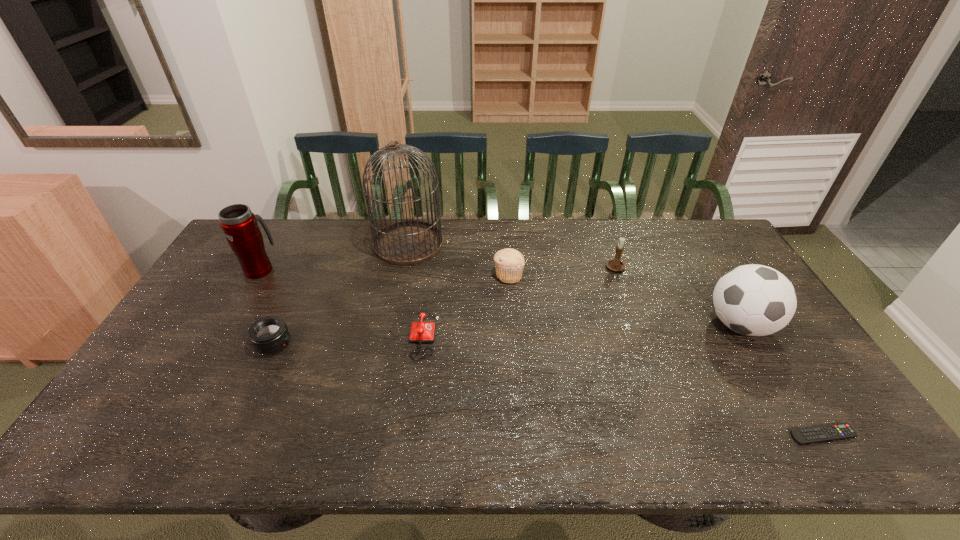
Locate an element on the screen. Image resolution: width=960 pixels, height=540 pixels. the shortest object is located at coordinates (808, 435).

This screenshot has height=540, width=960. Find the location of `vacant area situated 0.340m on the left of the tallest object`. vacant area situated 0.340m on the left of the tallest object is located at coordinates (279, 244).

What are the coordinates of `vacant space located on the side with the handle of the leftmost object` in the screenshot? It's located at (273, 248).

Find the location of a particular element. free space located 0.170m on the side with the handle of the leftmost object is located at coordinates (283, 231).

This screenshot has width=960, height=540. I want to click on free space located on the side with the handle of the leftmost object, so click(x=276, y=241).

Locate an element on the screen. This screenshot has height=540, width=960. free region located on the front of the third tallest object is located at coordinates (799, 424).

This screenshot has width=960, height=540. In order to click on free point located 0.100m on the side of the fifth shortest object with the handle in this screenshot , I will do `click(627, 298)`.

Identify the location of free spot located 0.280m on the left of the fifth tallest object. Image resolution: width=960 pixels, height=540 pixels. (408, 275).

Where is `free space located 0.160m on the side of the telephoto lens with brand markings and control switches`? free space located 0.160m on the side of the telephoto lens with brand markings and control switches is located at coordinates (349, 343).

This screenshot has width=960, height=540. Find the location of `free region located 0.340m on the dial of the telephone`. free region located 0.340m on the dial of the telephone is located at coordinates (557, 335).